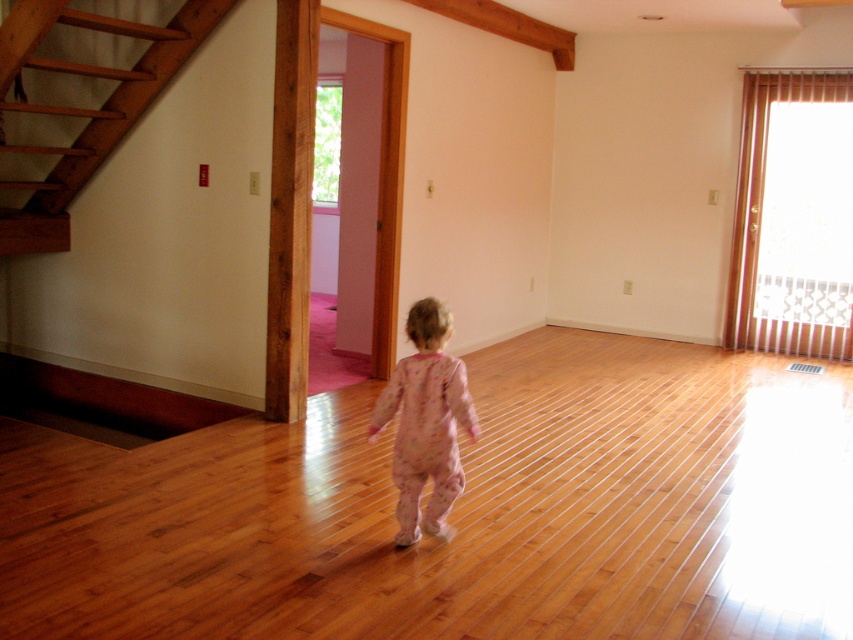
You are a parent trying to ensure your child stays safe while playing in the room. The wooden stairs at left and the pink cotton pajamas at center are in the room. Which object is bigger in size?

The wooden stairs at left are larger in size than the pink cotton pajamas at center.

You are standing in the room and see two points marked in the image. The first point is at coordinate (126, 44) and the second is at (448, 371). Which point is closer to you?

Point (126, 44) is closer to you than point (448, 371) because it is further to the camera.